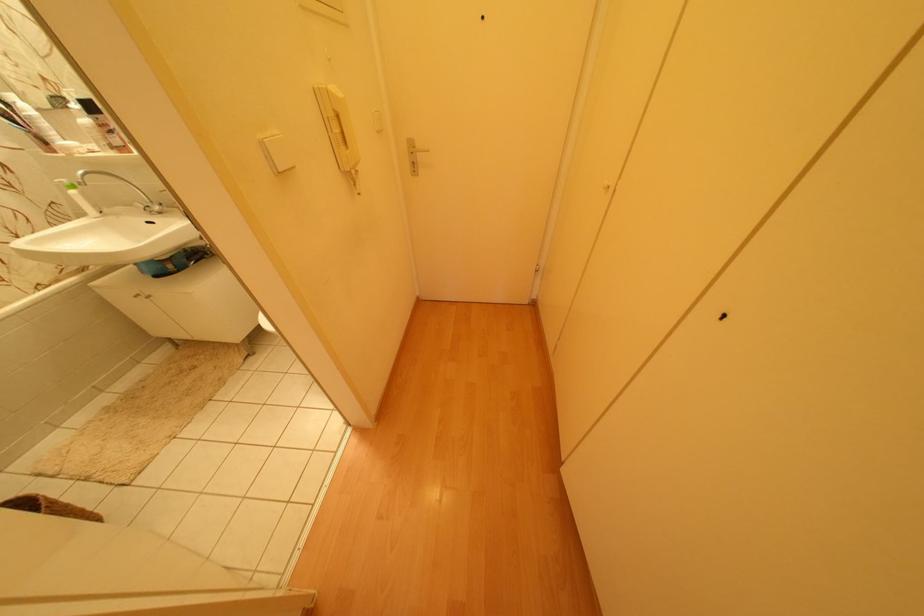
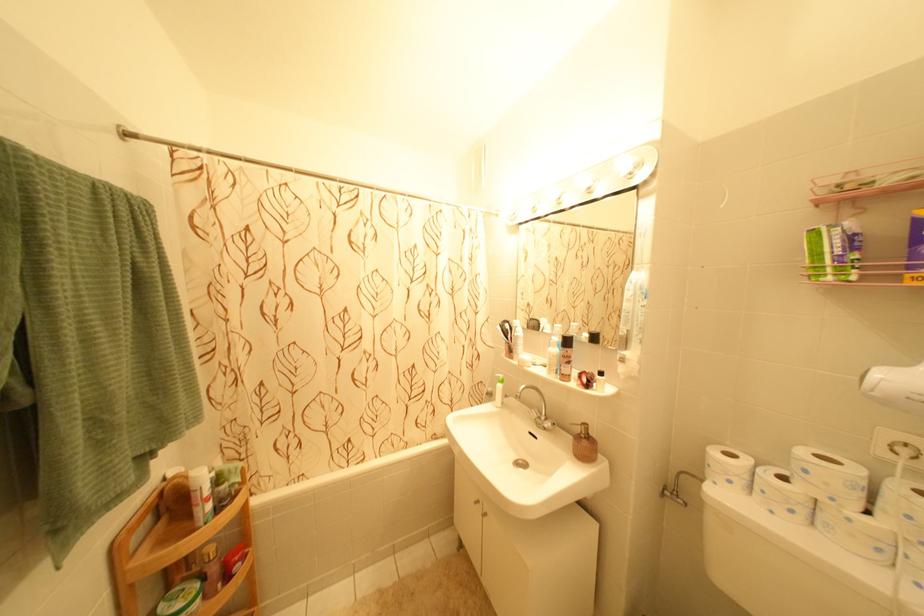
The images are taken continuously from a first-person perspective. In which direction is your viewpoint rotating?

The rotation direction of the camera is left-up.